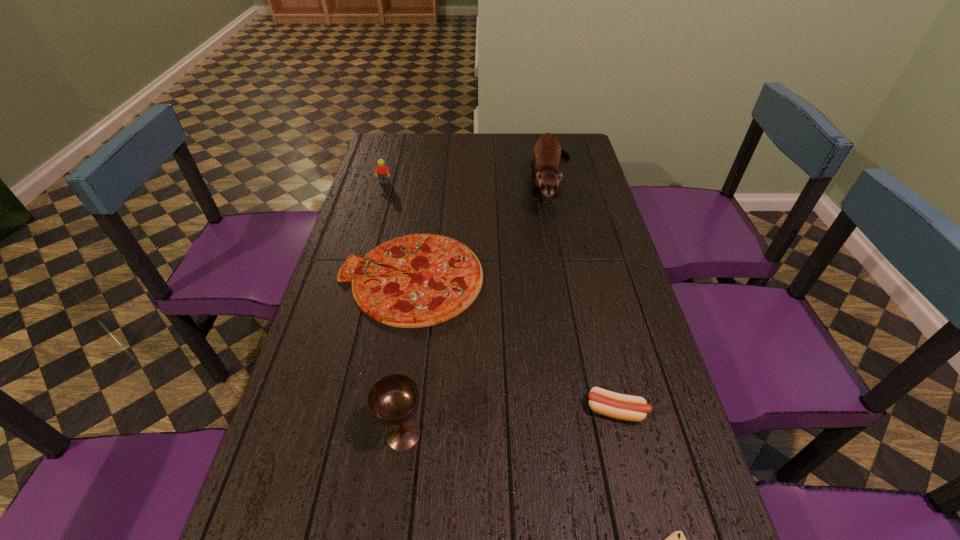
Image resolution: width=960 pixels, height=540 pixels. What are the coordinates of `ferret` in the screenshot? It's located at (545, 161).

Locate an element on the screen. chalice is located at coordinates (393, 400).

Find the location of a particular element. the fourth shortest object is located at coordinates (383, 173).

This screenshot has height=540, width=960. Find the location of `the third shortest object`. the third shortest object is located at coordinates (625, 407).

I want to click on the second shortest object, so click(444, 277).

This screenshot has width=960, height=540. Identify the location of pizza. (444, 277).

Where is `vacant area located 0.120m at the face of the ferret`? The image size is (960, 540). vacant area located 0.120m at the face of the ferret is located at coordinates (565, 250).

Find the location of a particular element. The width and height of the screenshot is (960, 540). vacant space located 0.260m on the right of the chalice is located at coordinates (546, 435).

This screenshot has height=540, width=960. Find the location of `vacant region located on the face of the third tallest object`. vacant region located on the face of the third tallest object is located at coordinates (380, 198).

Where is `vacant position located on the left of the fourth tallest object`? The image size is (960, 540). vacant position located on the left of the fourth tallest object is located at coordinates (538, 410).